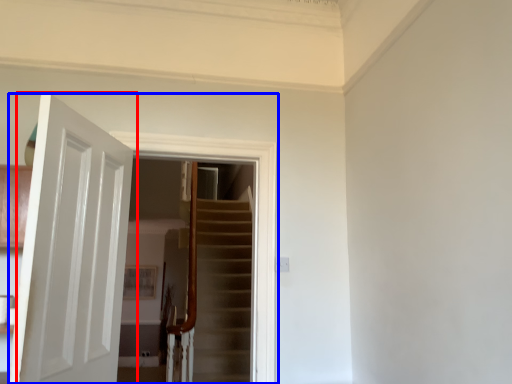
Question: Which object appears farthest to the camera in this image, door (highlighted by a red box) or screen door (highlighted by a blue box)?

Choices:
 (A) door
 (B) screen door

Answer: (B)